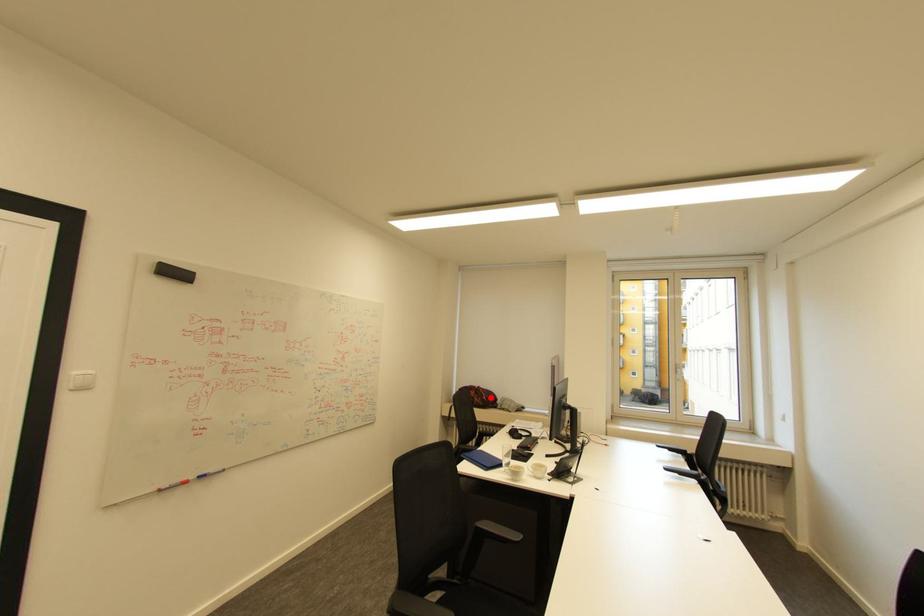
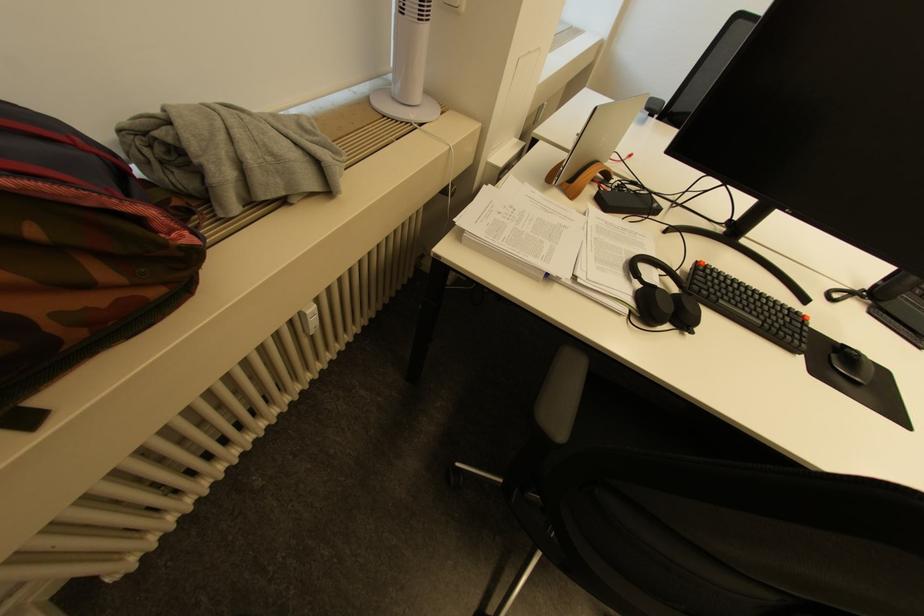
Question: I am providing you with two images of the same scene from different viewpoints. In image1, a red point is highlighted. Considering the same 3D point in image2, which of the following is correct?

Choices:
 (A) It is closer
 (B) It is farther

Answer: (A)